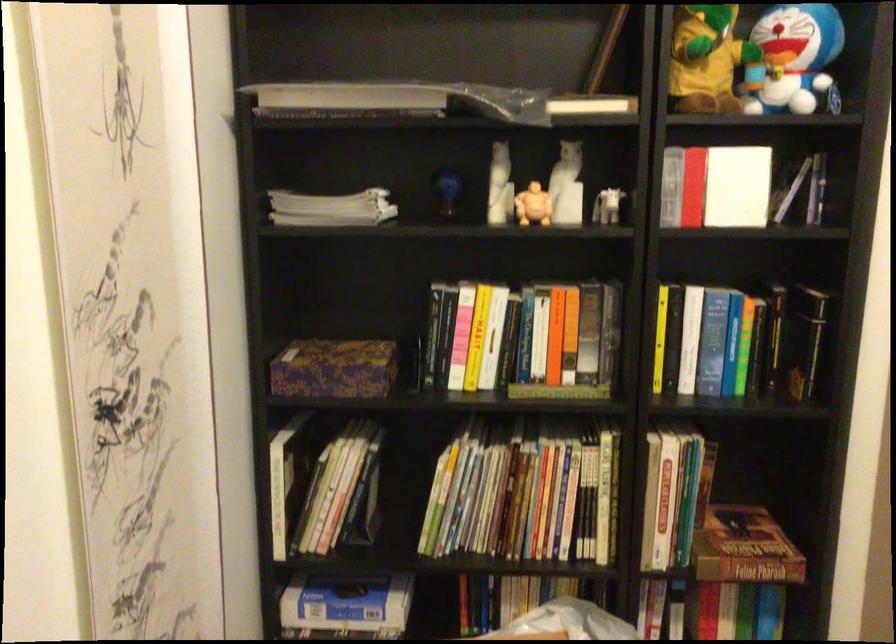
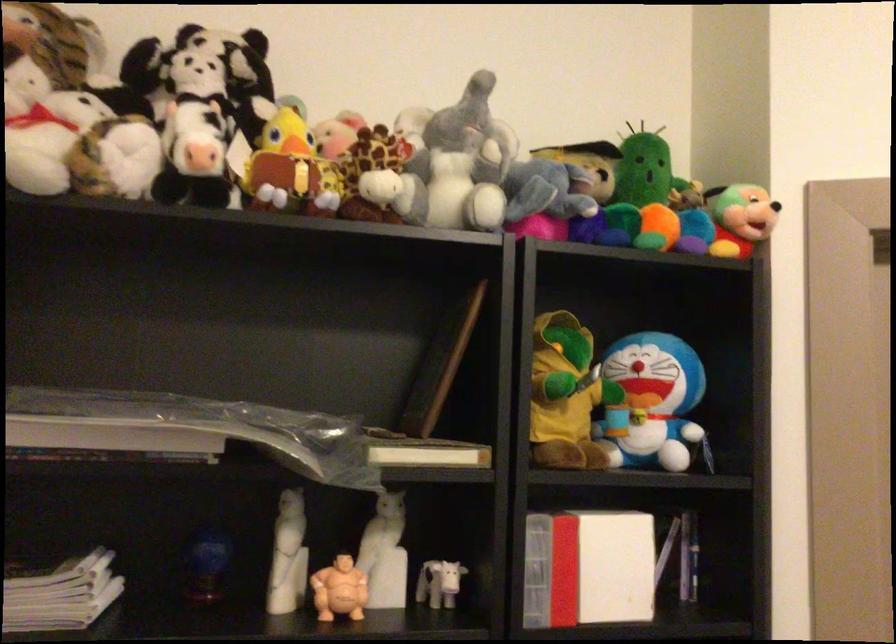
Question: The images are taken continuously from a first-person perspective. In which direction are you moving?

Choices:
 (A) Left
 (B) Right
 (C) Forward
 (D) Backward

Answer: (C)